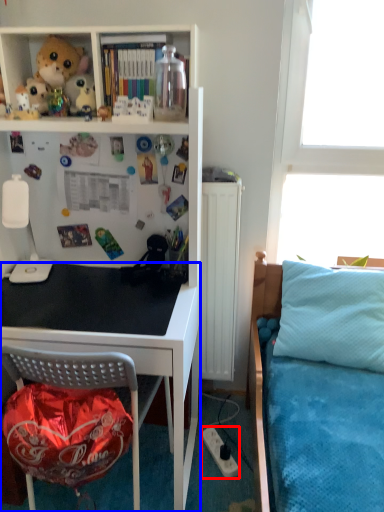
Question: Which object is further to the camera taking this photo, power outlet (highlighted by a red box) or desk (highlighted by a blue box)?

Choices:
 (A) power outlet
 (B) desk

Answer: (A)